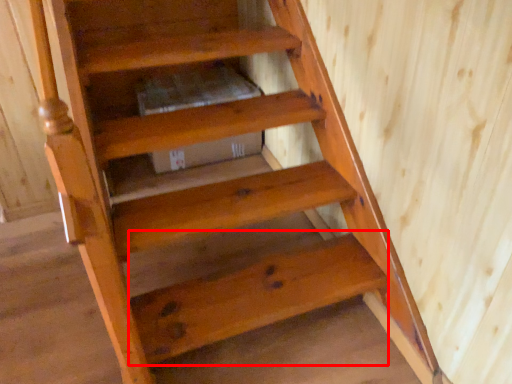
Question: From the image's perspective, where is stairwell (annotated by the red box) located relative to stairwell?

Choices:
 (A) above
 (B) below

Answer: (B)